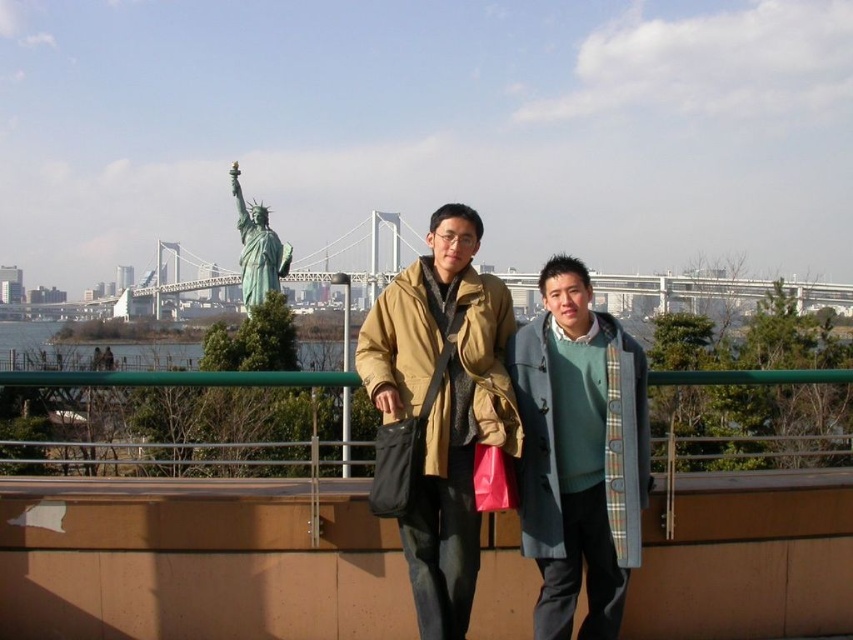
Question: Among these objects, which one is nearest to the camera?

Choices:
 (A) matte brown coat at center
 (B) green patina statue at upper center

Answer: (A)

Question: Which object is positioned farthest from the green patina statue at upper center?

Choices:
 (A) gray wool coat at center
 (B) matte brown coat at center

Answer: (A)

Question: Can you confirm if matte brown coat at center is positioned above gray wool coat at center?

Choices:
 (A) no
 (B) yes

Answer: (B)

Question: Which object is positioned farthest from the gray wool coat at center?

Choices:
 (A) green patina statue at upper center
 (B) matte brown coat at center

Answer: (A)

Question: In this image, where is matte brown coat at center located relative to gray wool coat at center?

Choices:
 (A) left
 (B) right

Answer: (A)

Question: Observing the image, what is the correct spatial positioning of matte brown coat at center in reference to gray wool coat at center?

Choices:
 (A) left
 (B) right

Answer: (A)